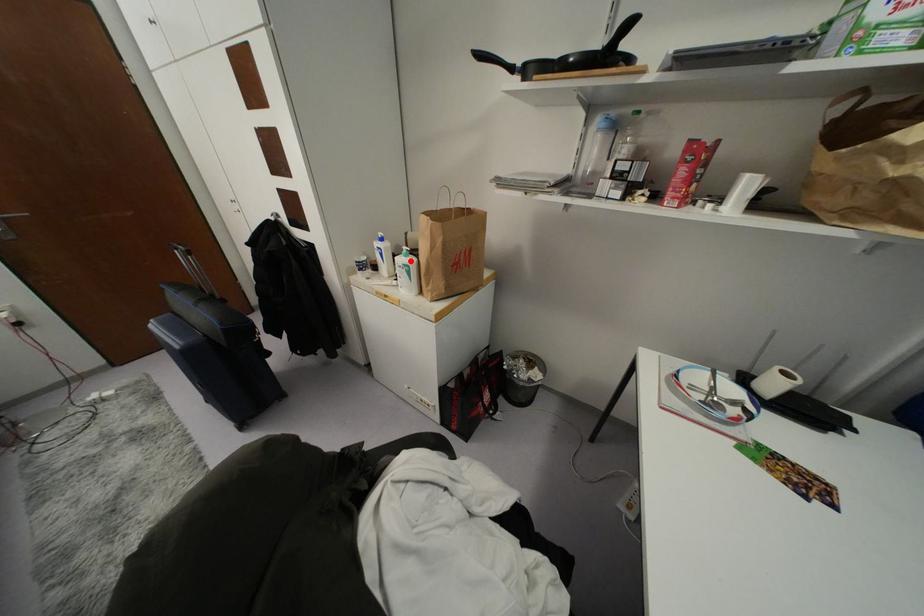
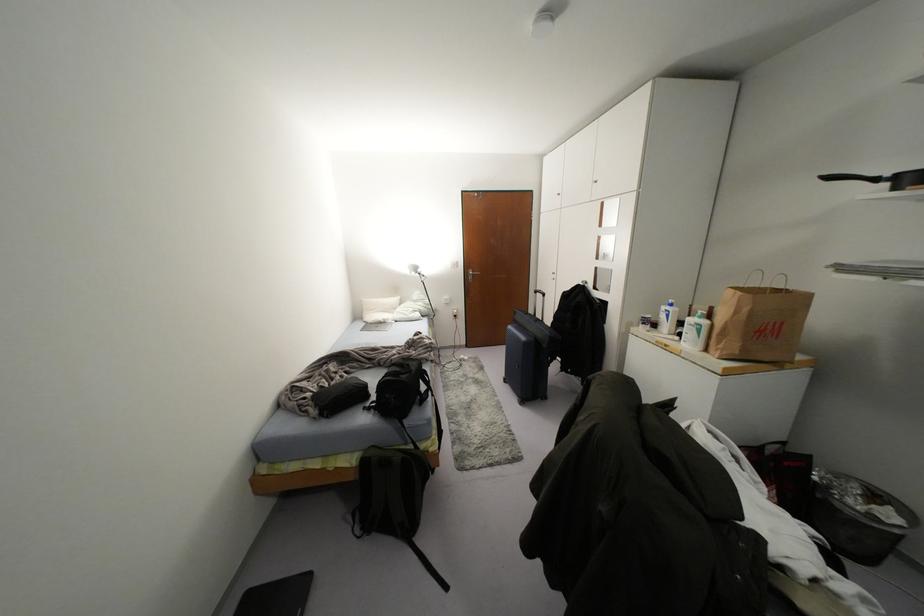
Question: I am providing you with two images of the same scene from different viewpoints. A red point is marked on the first image. Can you still see the location of the red point in image 2?

Choices:
 (A) Yes
 (B) No

Answer: (A)